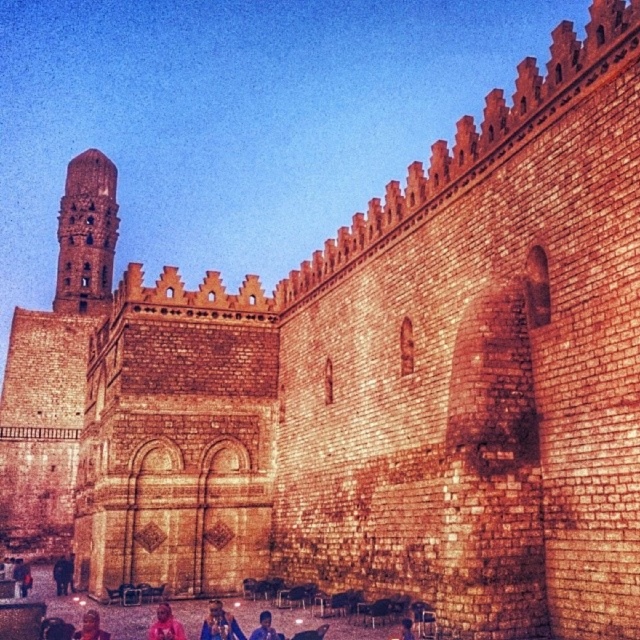
Question: Which point is farther from the camera taking this photo?

Choices:
 (A) (150, 637)
 (B) (269, 618)

Answer: (B)

Question: Can you confirm if blue fabric shirt at lower center is bigger than blue denim jacket at lower center?

Choices:
 (A) yes
 (B) no

Answer: (A)

Question: Estimate the real-world distances between objects in this image. Which object is closer to the rustic stone tower at upper left?

Choices:
 (A) matte black person at lower left
 (B) blue denim jeans at lower center

Answer: (B)

Question: Considering the relative positions of pink fabric at lower center and matte black person at lower left in the image provided, where is pink fabric at lower center located with respect to matte black person at lower left?

Choices:
 (A) below
 (B) above

Answer: (A)

Question: Which of the following is the closest to the observer?

Choices:
 (A) pink fabric at lower center
 (B) blue denim jeans at lower center
 (C) smooth skin person at lower left
 (D) rustic stone tower at upper left

Answer: (A)

Question: In this image, where is pink fabric at lower center located relative to blue denim jacket at lower center?

Choices:
 (A) above
 (B) below

Answer: (B)